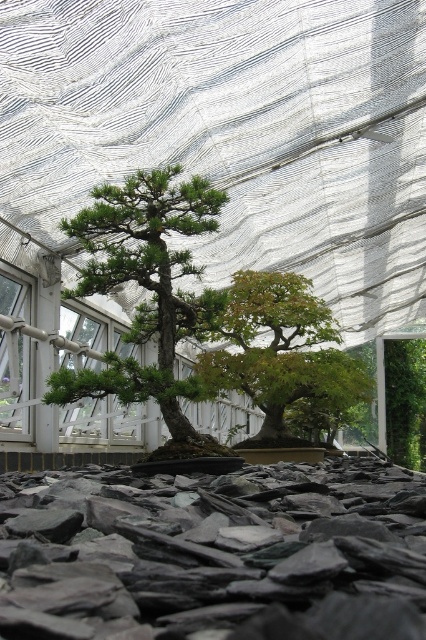
Question: Estimate the real-world distances between objects in this image. Which object is closer to the green matte bonsai at center?

Choices:
 (A) green glossy bonsai at center
 (B) dark gray slate at center

Answer: (A)

Question: Which point is closer to the camera taking this photo?

Choices:
 (A) (230, 547)
 (B) (213, 332)

Answer: (A)

Question: Where is dark gray slate at center located in relation to green glossy bonsai at center in the image?

Choices:
 (A) below
 (B) above

Answer: (A)

Question: Is dark gray slate at center in front of green matte bonsai at center?

Choices:
 (A) yes
 (B) no

Answer: (A)

Question: Among these points, which one is nearest to the camera?

Choices:
 (A) (123, 208)
 (B) (284, 374)
 (C) (385, 552)

Answer: (C)

Question: In this image, where is green matte bonsai at center located relative to green glossy bonsai at center?

Choices:
 (A) left
 (B) right

Answer: (A)